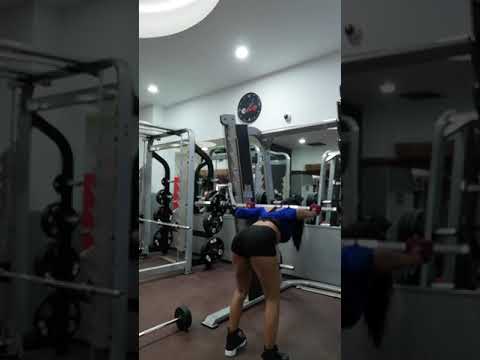
This screenshot has height=360, width=480. I want to click on ceiling, so click(148, 28).